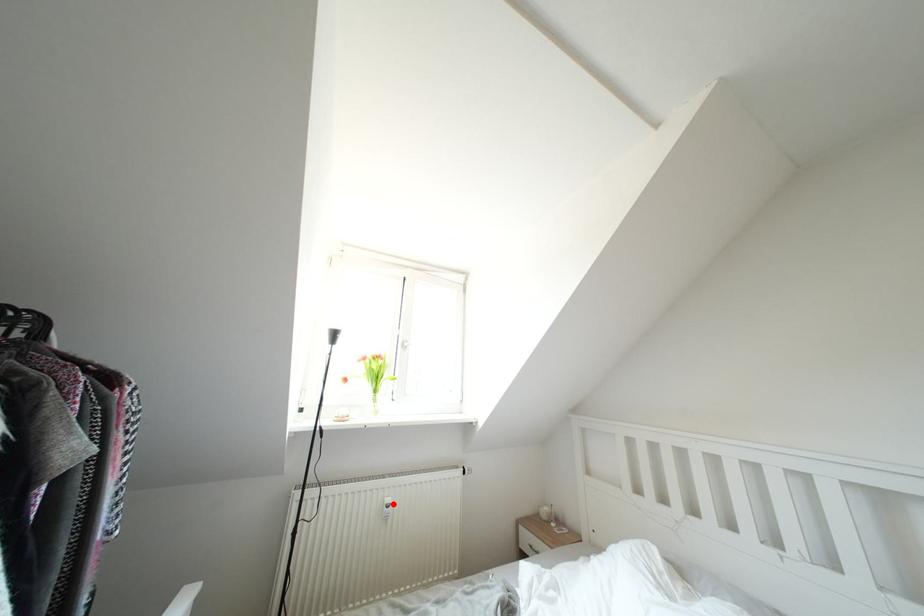
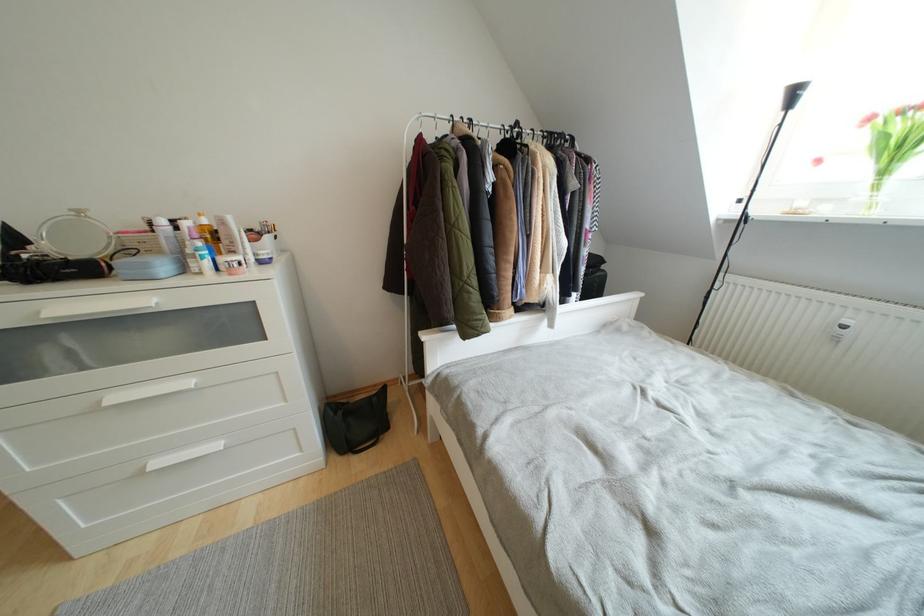
Locate, in the second image, the point that corresponds to the highlighted location in the first image.

(853, 326)